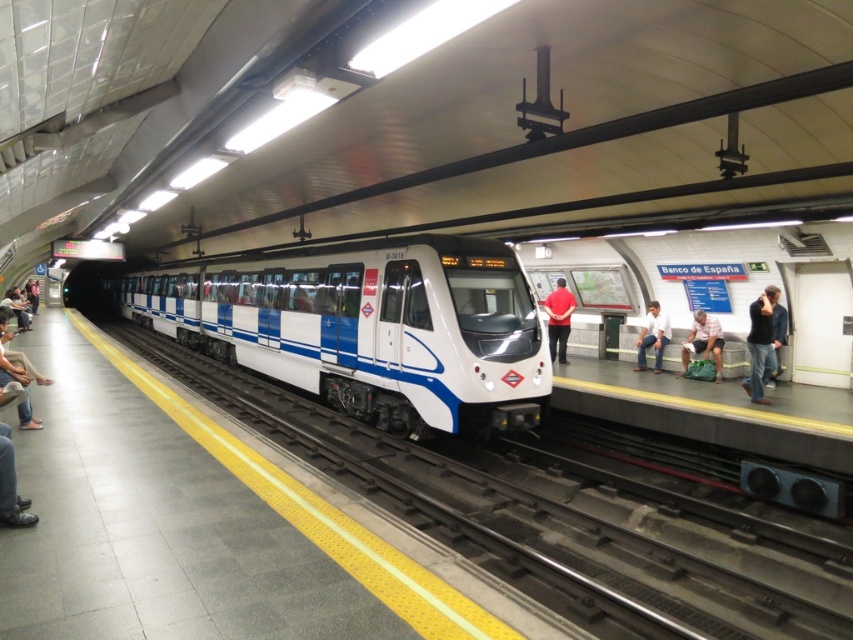
Question: Which object is closer to the camera taking this photo?

Choices:
 (A) white metal train track at center
 (B) dark blue jeans at right

Answer: (A)

Question: Does white glossy train at center have a smaller size compared to white metal train track at center?

Choices:
 (A) no
 (B) yes

Answer: (A)

Question: Is white metal train track at center below dark blue jeans at right?

Choices:
 (A) no
 (B) yes

Answer: (B)

Question: Considering the real-world distances, which object is closest to the denim pants at lower left?

Choices:
 (A) white glossy train at center
 (B) white cotton shirt at center

Answer: (A)

Question: Can you confirm if white glossy train at center is positioned to the left of green fabric bag at right?

Choices:
 (A) no
 (B) yes

Answer: (B)

Question: Which of the following is the closest to the observer?

Choices:
 (A) red cotton shirt at center
 (B) green fabric bag at right
 (C) dark blue jeans at right
 (D) denim pants at lower left

Answer: (D)